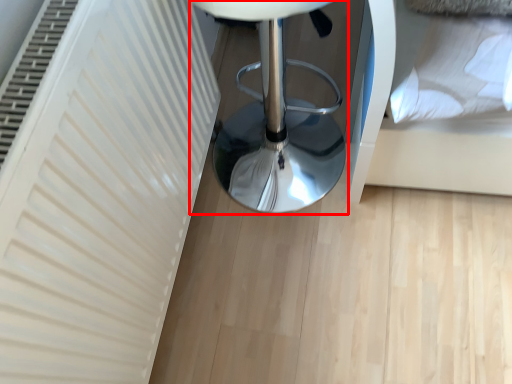
Question: From the image's perspective, considering the relative positions of furniture (annotated by the red box) and bed in the image provided, where is furniture (annotated by the red box) located with respect to the staircase?

Choices:
 (A) below
 (B) above

Answer: (A)